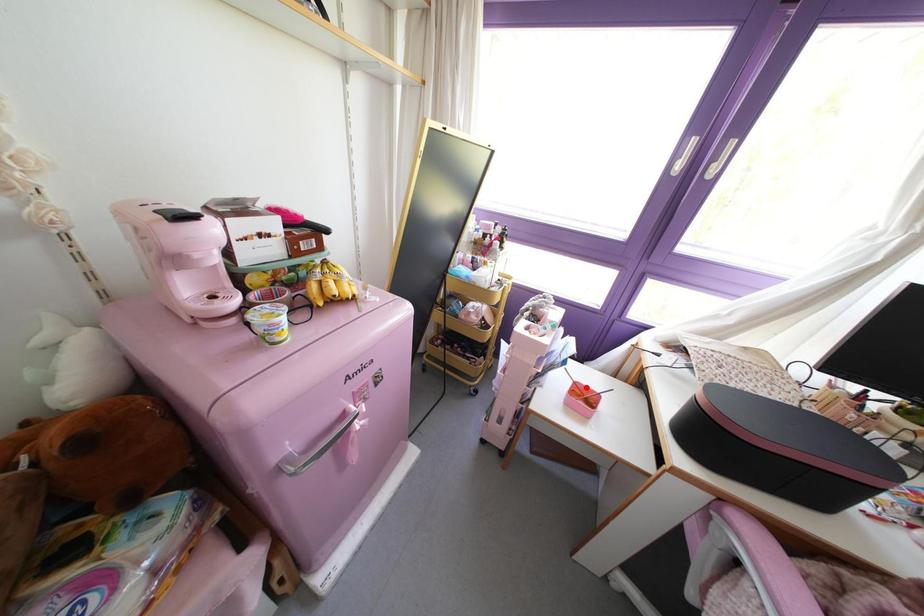
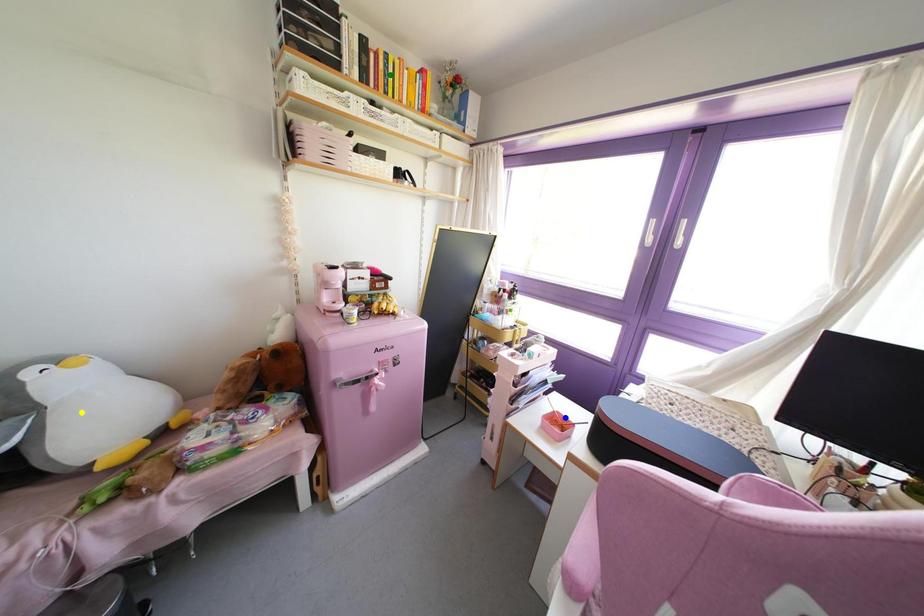
Question: I am providing you with two images of the same scene from different viewpoints. A red point is marked on the first image. You are given multiple points on the second image. Which mark in image 2 goes with the point in image 1?

Choices:
 (A) yellow point
 (B) green point
 (C) blue point

Answer: (C)